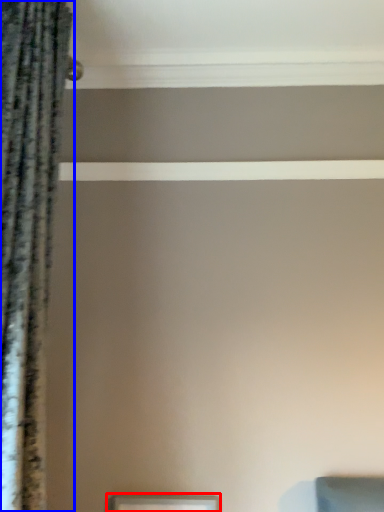
Question: Which object appears farthest to the camera in this image, picture frame (highlighted by a red box) or curtain (highlighted by a blue box)?

Choices:
 (A) picture frame
 (B) curtain

Answer: (A)